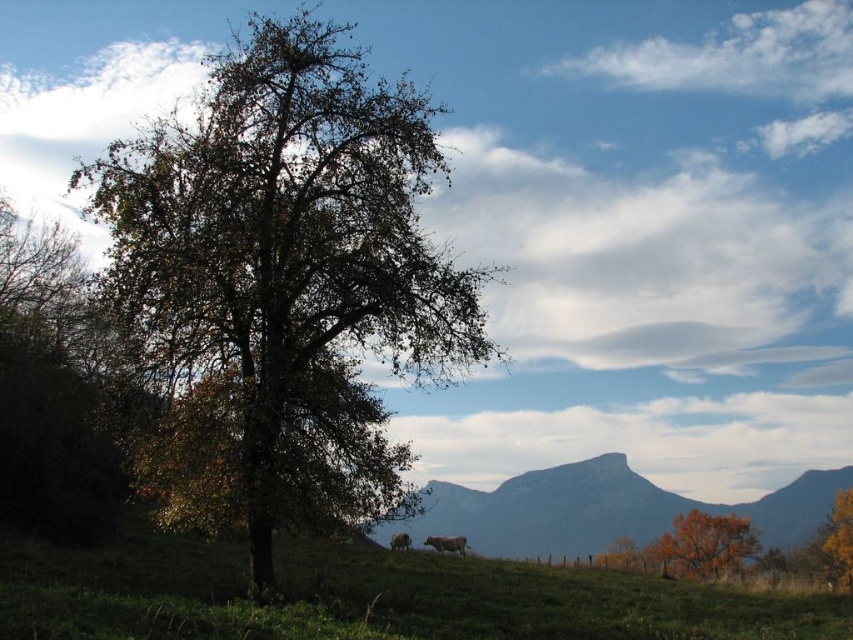
Question: Does green leafy tree at center appear on the right side of smooth gray rock at center?

Choices:
 (A) no
 (B) yes

Answer: (A)

Question: Which point is closer to the camera?

Choices:
 (A) orange leafy tree at lower right
 (B) green leafy tree at center
 (C) green grassy field at lower center
 (D) smooth gray rock at center

Answer: (C)

Question: Is green grassy field at lower center further to camera compared to smooth gray rock at center?

Choices:
 (A) no
 (B) yes

Answer: (A)

Question: Which object is the closest to the orange leafy tree at lower right?

Choices:
 (A) smooth gray rock at center
 (B) green leafy tree at center

Answer: (A)

Question: Is green grassy field at lower center below smooth gray rock at center?

Choices:
 (A) yes
 (B) no

Answer: (B)

Question: Which object is positioned closest to the smooth gray rock at center?

Choices:
 (A) green grassy field at lower center
 (B) orange leafy tree at lower right

Answer: (B)